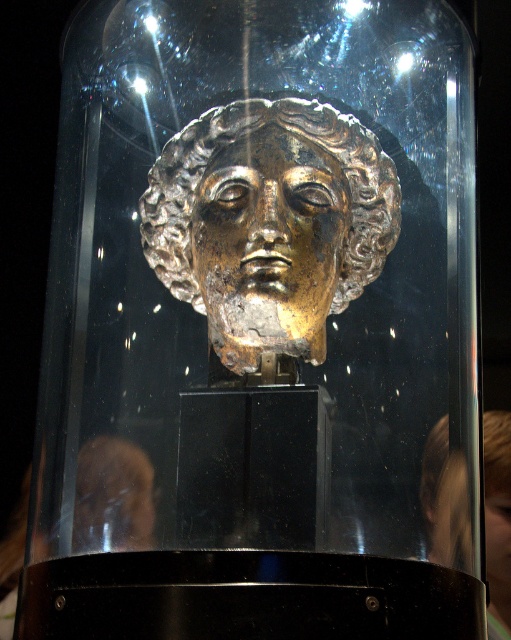
Identify the location of gold/gilded metallic bust at center. The image size is (511, 640). (269, 224).

Is gold/gilded metallic bust at center positioned at the back of gold/gilded bronze head at center?

Yes, gold/gilded metallic bust at center is behind gold/gilded bronze head at center.

You are a GUI agent. You are given a task and a screenshot of the screen. Output one action in this format:
    pyautogui.click(x=<x>, y=<y>)
    Task: Click on the gold/gilded metallic bust at center
    The image size is (511, 640).
    Given the screenshot: What is the action you would take?
    pyautogui.click(x=269, y=224)

Is gold/gilded bronze head at center smaller than gold metallic head at center?

Indeed, gold/gilded bronze head at center has a smaller size compared to gold metallic head at center.

Can you confirm if gold/gilded bronze head at center is bigger than gold metallic head at center?

Actually, gold/gilded bronze head at center might be smaller than gold metallic head at center.

Identify the location of gold/gilded bronze head at center. Image resolution: width=511 pixels, height=640 pixels. (269, 230).

Consider the image. Does gold/gilded metallic bust at center have a lesser width compared to gold metallic head at center?

No, gold/gilded metallic bust at center is not thinner than gold metallic head at center.

Is gold/gilded metallic bust at center closer to camera compared to gold metallic head at center?

No, it is behind gold metallic head at center.

Which is behind, point (336, 161) or point (438, 452)?

The point (336, 161) is behind.

You are a GUI agent. You are given a task and a screenshot of the screen. Output one action in this format:
    pyautogui.click(x=<x>, y=<y>)
    Task: Click on the gold/gilded metallic bust at center
    Image resolution: width=511 pixels, height=640 pixels.
    Given the screenshot: What is the action you would take?
    pyautogui.click(x=269, y=224)